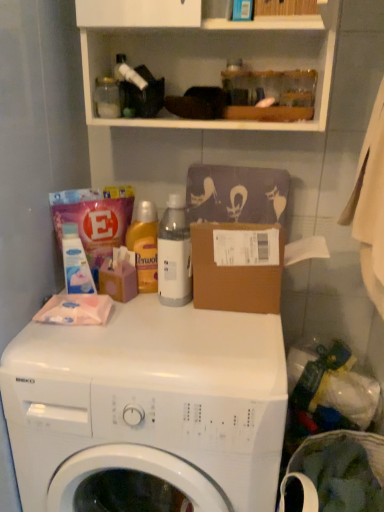
Find the location of a particular element. The image size is (384, 512). spots to the right of white plastic bottle at center is located at coordinates (233, 317).